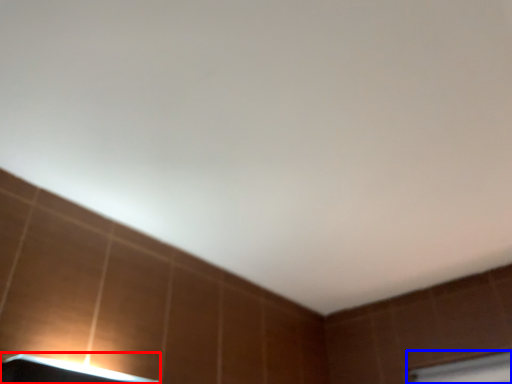
Question: Which point is closer to the camera, lamp (highlighted by a red box) or window frame (highlighted by a blue box)?

Choices:
 (A) lamp
 (B) window frame

Answer: (A)